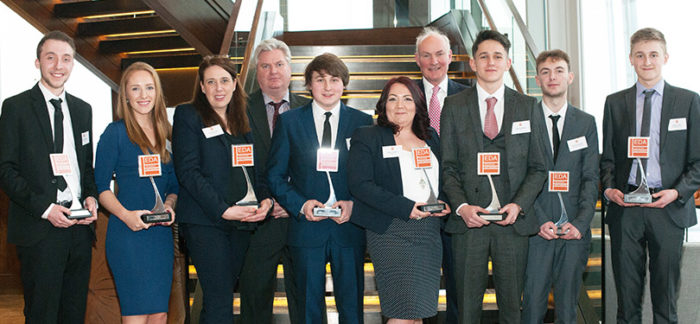
Where is `award`? award is located at coordinates (80, 207), (157, 215), (251, 193), (323, 207), (428, 205), (490, 206), (558, 223), (637, 190).